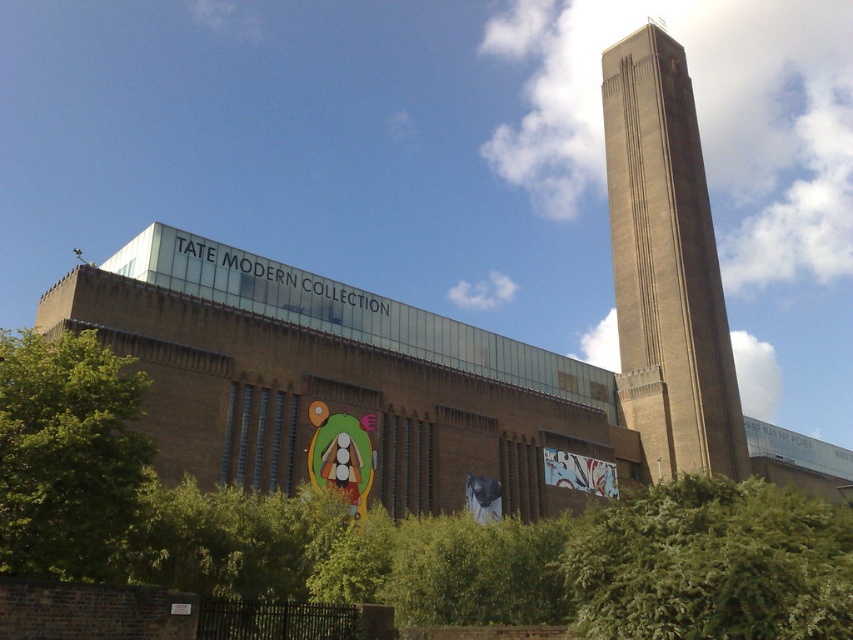
Question: Is green leafy bush at lower right above green leafy tree at lower left?

Choices:
 (A) yes
 (B) no

Answer: (B)

Question: Is green leafy bush at lower right positioned before green leafy tree at lower left?

Choices:
 (A) yes
 (B) no

Answer: (A)

Question: Which of the following is the closest to the observer?

Choices:
 (A) (129, 433)
 (B) (614, 518)
 (C) (656, 317)

Answer: (A)

Question: Which is nearer to the green leafy bush at lower right?

Choices:
 (A) brown brick tower at upper right
 (B) green leafy tree at lower left

Answer: (B)

Question: Can you confirm if brown brick tower at upper right is wider than green leafy bush at lower right?

Choices:
 (A) no
 (B) yes

Answer: (B)

Question: Which of the following is the farthest from the observer?

Choices:
 (A) (3, 572)
 (B) (689, 536)

Answer: (B)